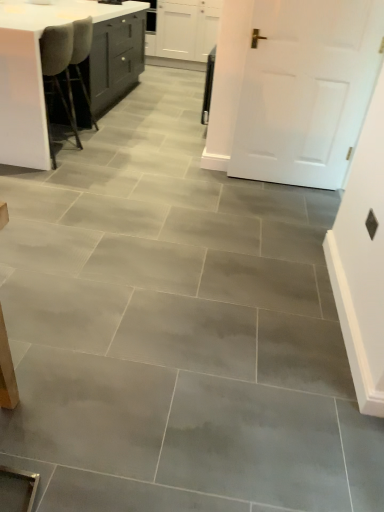
Question: Do you think white glossy table at upper left is within white matte door at upper right, or outside of it?

Choices:
 (A) inside
 (B) outside

Answer: (B)

Question: From a real-world perspective, is white glossy table at upper left above or below white matte door at upper right?

Choices:
 (A) above
 (B) below

Answer: (B)

Question: Considering the real-world distances, which object is closest to the white matte cabinet at upper center?

Choices:
 (A) white glossy table at upper left
 (B) white matte door at upper right

Answer: (A)

Question: Estimate the real-world distances between objects in this image. Which object is closer to the white matte cabinet at upper center?

Choices:
 (A) white matte door at upper right
 (B) white glossy table at upper left

Answer: (B)